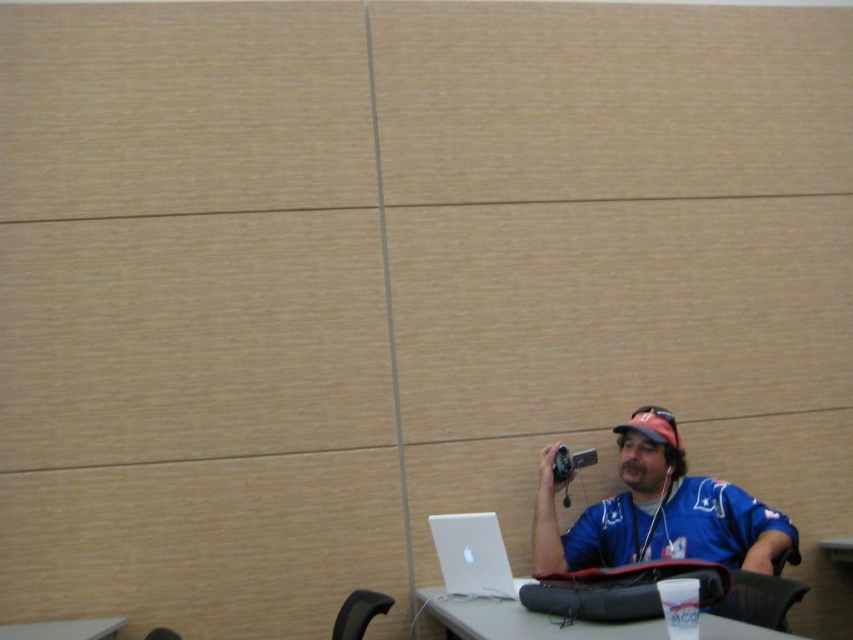
Question: Which point appears farthest from the camera in this image?

Choices:
 (A) (569, 465)
 (B) (0, 630)

Answer: (A)

Question: Which point is closer to the camera taking this photo?

Choices:
 (A) (123, 624)
 (B) (560, 458)

Answer: (A)

Question: Can you confirm if smooth gray table at lower left is wider than silver metallic video camera at upper right?

Choices:
 (A) yes
 (B) no

Answer: (A)

Question: Does white plastic table at lower center have a lesser width compared to silver metallic laptop at lower center?

Choices:
 (A) yes
 (B) no

Answer: (B)

Question: Which point appears farthest from the camera in this image?

Choices:
 (A) (489, 556)
 (B) (757, 508)
 (C) (80, 628)

Answer: (B)

Question: Does blue jersey at lower right have a greater width compared to white plastic table at lower center?

Choices:
 (A) no
 (B) yes

Answer: (A)